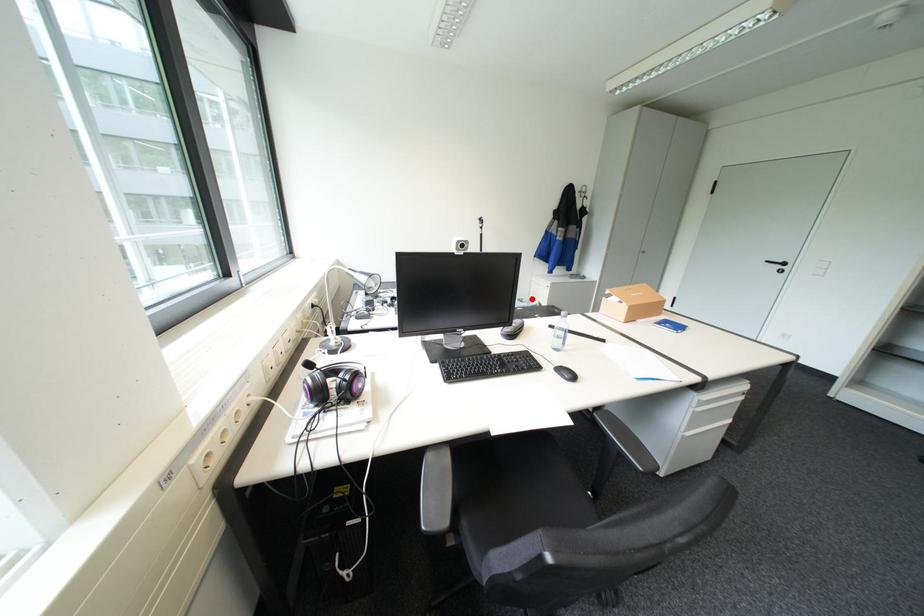
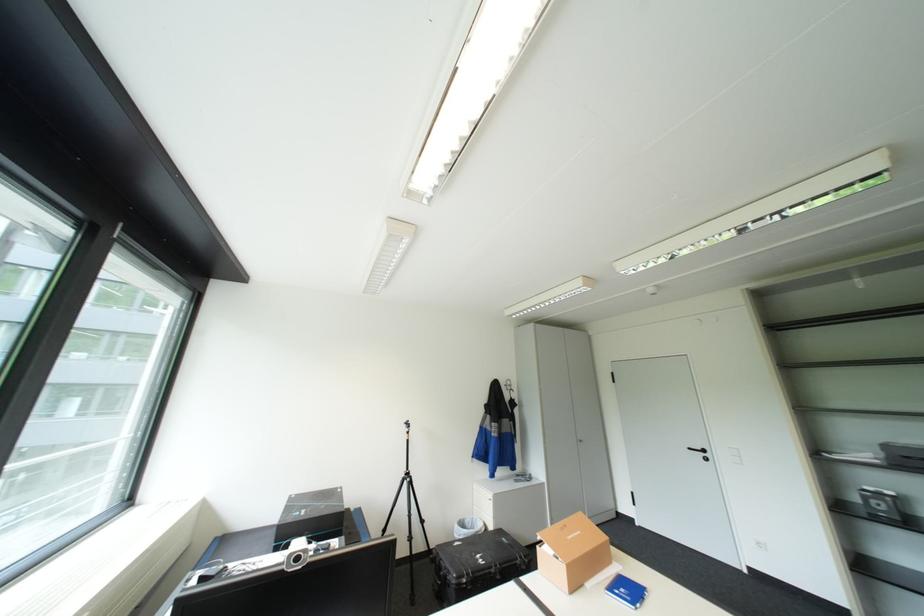
Find the pixel in the second image that matches the highlighted location in the first image.

(475, 521)